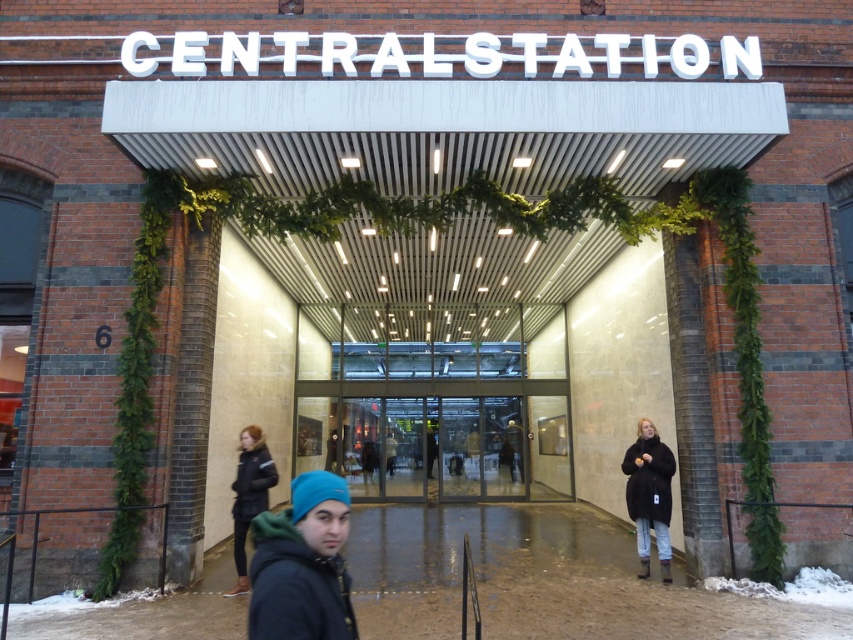
You are a delivery person holding a package and need to enter the building through the entrance. The transparent glass doors at center are the main entrance. The black jacket at lower left is lying on the ground. Which object is larger in size?

The transparent glass doors at center is bigger than the black jacket at lower left according to the description.

You are standing at the entrance of CentralStation and notice a blue knit cap at lower center and a black fuzzy coat at lower right. Which item is positioned higher from the ground?

The blue knit cap at lower center is located above the black fuzzy coat at lower right, so it is positioned higher from the ground.

You are standing at the entrance of the building labeled CENTRALSTATION. You see transparent glass doors at center and a black jacket at lower left. Which object is closer to the entrance sign?

The transparent glass doors at center are positioned under the black jacket at lower left, meaning the black jacket at lower left is closer to the entrance sign.